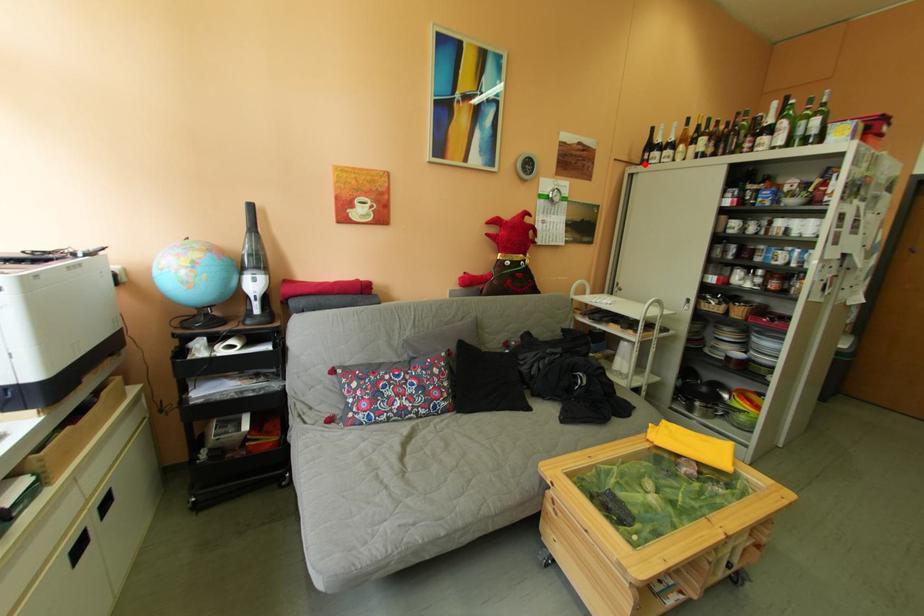
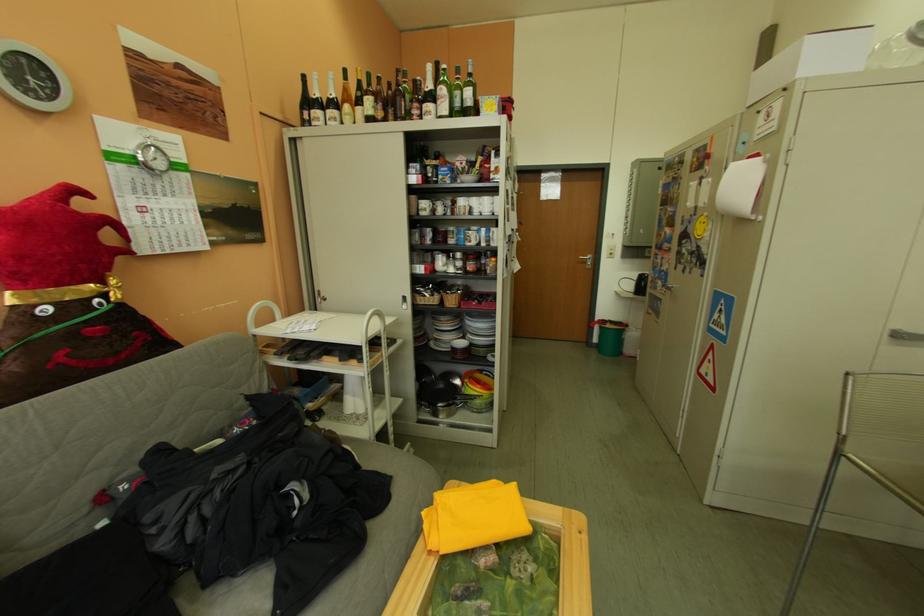
Question: I am providing you with two images of the same scene from different viewpoints. A red point is marked on the first image. At the location where the point appears in image 1, is it still visible in image 2?

Choices:
 (A) Yes
 (B) No

Answer: (A)